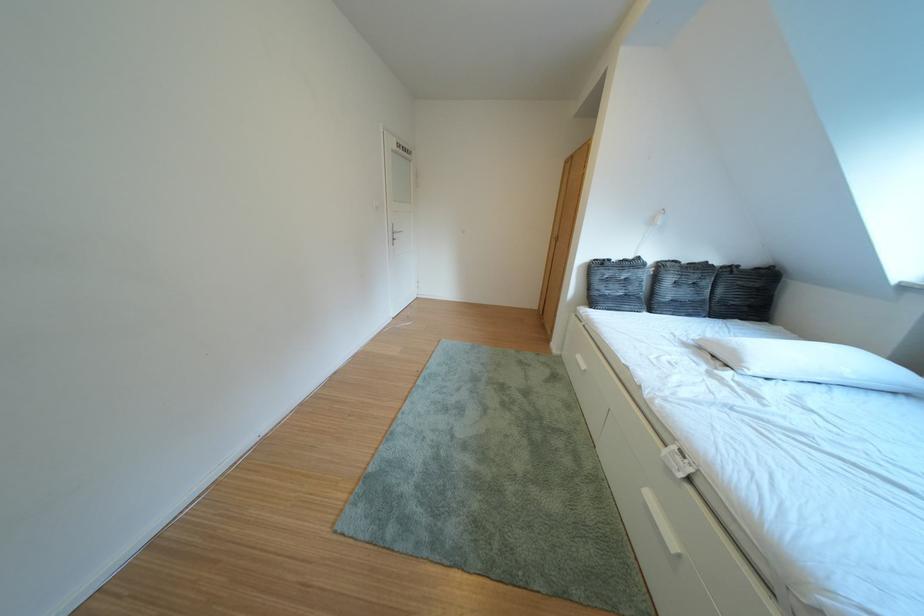
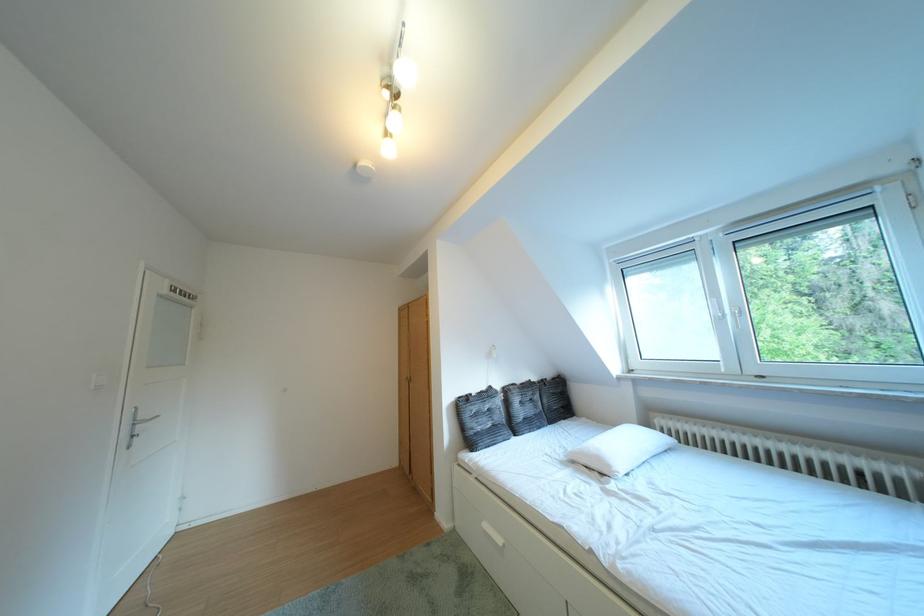
Find the pixel in the second image that matches point (652, 262) in the first image.

(504, 392)